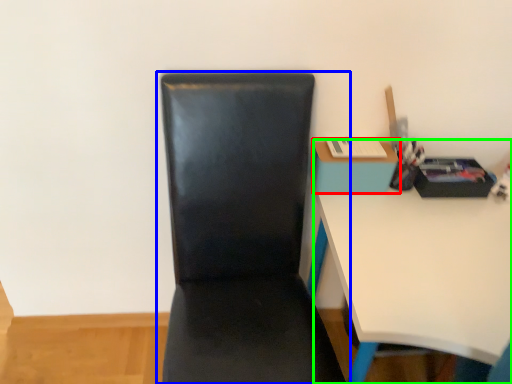
Question: Which is farther away from table (highlighted by a red box)? chair (highlighted by a blue box) or desk (highlighted by a green box)?

Choices:
 (A) chair
 (B) desk

Answer: (A)